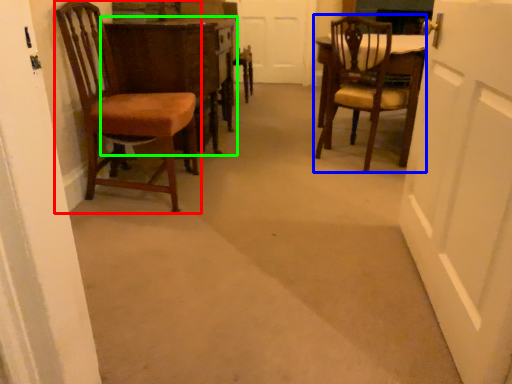
Question: Estimate the real-world distances between objects in this image. Which object is closer to chair (highlighted by a red box), chair (highlighted by a blue box) or table (highlighted by a green box)?

Choices:
 (A) chair
 (B) table

Answer: (B)